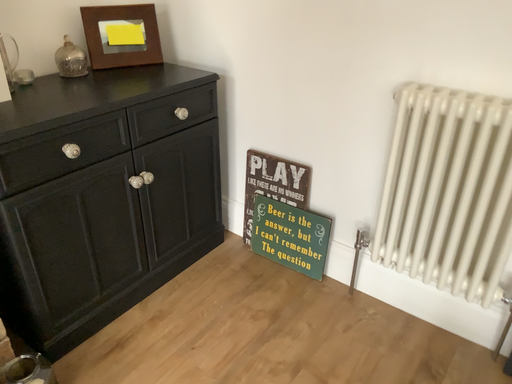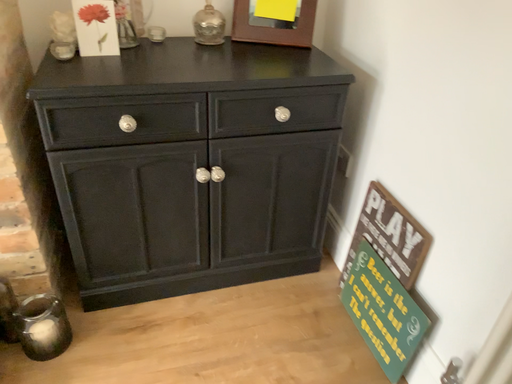
Question: How did the camera likely rotate when shooting the video?

Choices:
 (A) rotated right
 (B) rotated left

Answer: (B)